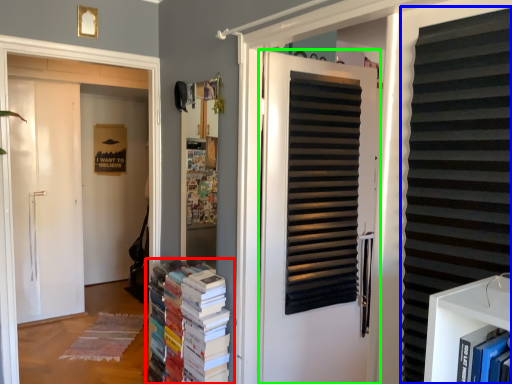
Question: Which object is the closest to the book (highlighted by a red box)? Choose among these: shutter (highlighted by a blue box) or door (highlighted by a green box).

Choices:
 (A) shutter
 (B) door

Answer: (B)